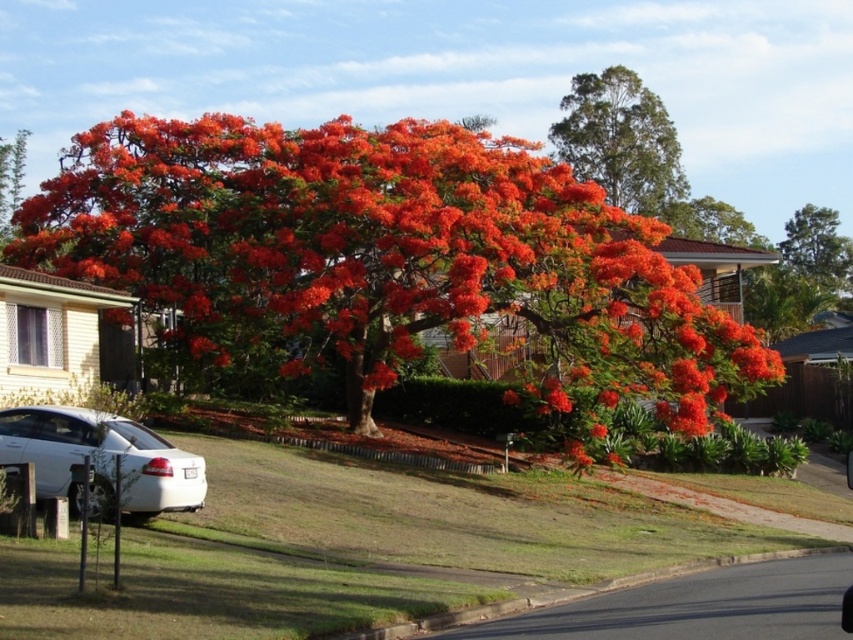
Question: Which point is closer to the camera?

Choices:
 (A) (738, 212)
 (B) (791, 276)
 (C) (122, 481)

Answer: (C)

Question: Where is fluffy orange blossoms at upper center located in relation to orange vibrant leaves at center in the image?

Choices:
 (A) right
 (B) left

Answer: (A)

Question: Is green leafy tree at upper right to the right of orange vibrant leaves at center from the viewer's perspective?

Choices:
 (A) yes
 (B) no

Answer: (A)

Question: Which of the following is the closest to the observer?

Choices:
 (A) (122, 508)
 (B) (809, 225)
 (C) (474, 132)
 (D) (805, 298)

Answer: (A)

Question: Among these points, which one is farthest from the camera?

Choices:
 (A) (636, 189)
 (B) (798, 298)
 (C) (668, 211)
 (D) (1, 180)

Answer: (D)

Question: Does orange matte tree at right have a lesser width compared to fluffy orange blossoms at upper center?

Choices:
 (A) yes
 (B) no

Answer: (A)